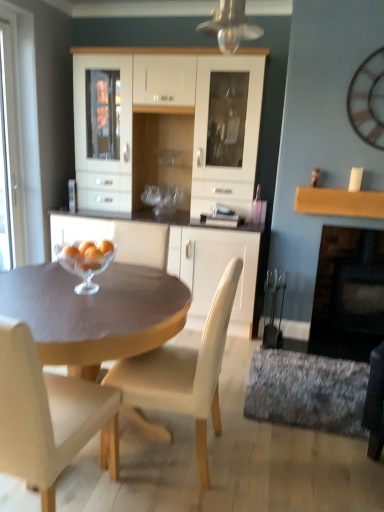
Identify the location of free region on the left part of clear glass bowl at center. This screenshot has height=512, width=384. (41, 287).